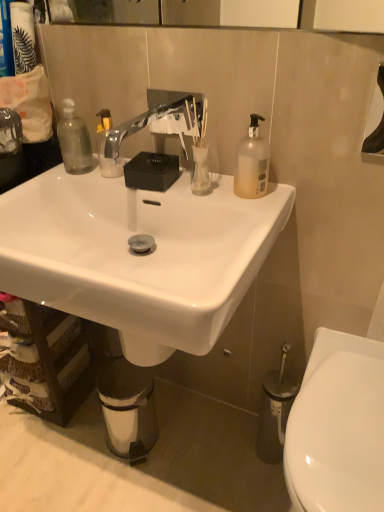
This screenshot has height=512, width=384. I want to click on free space in front of brown woven basket at lower left, so click(x=49, y=459).